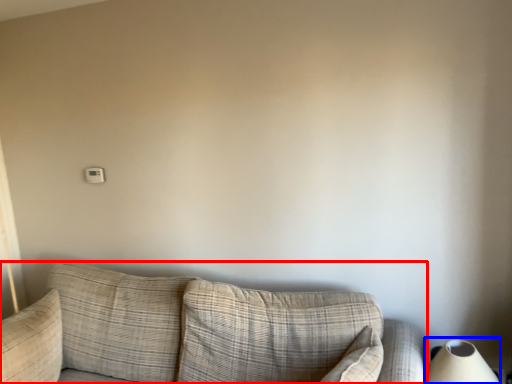
Question: Among these objects, which one is nearest to the camera, studio couch (highlighted by a red box) or table lamp (highlighted by a blue box)?

Choices:
 (A) studio couch
 (B) table lamp

Answer: (A)